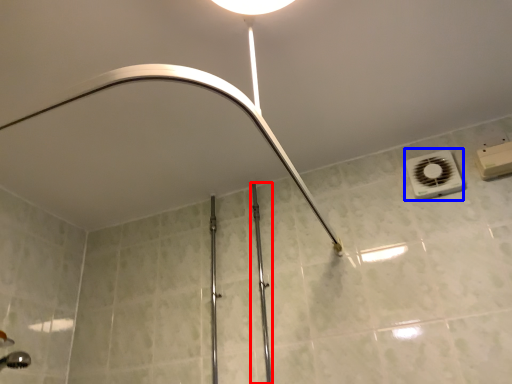
Question: Which object appears closest to the camera in this image, rail (highlighted by a red box) or air conditioning (highlighted by a blue box)?

Choices:
 (A) rail
 (B) air conditioning

Answer: (A)